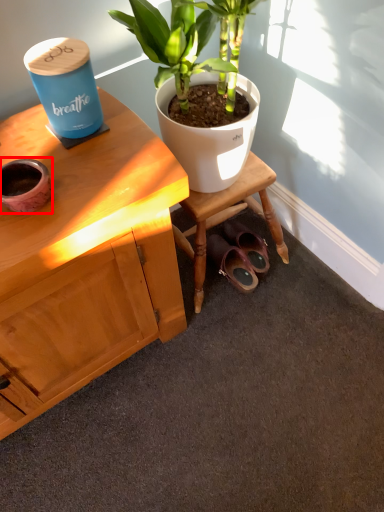
Question: From the image's perspective, what is the correct spatial positioning of flowerpot (annotated by the red box) in reference to footwear?

Choices:
 (A) below
 (B) above

Answer: (B)